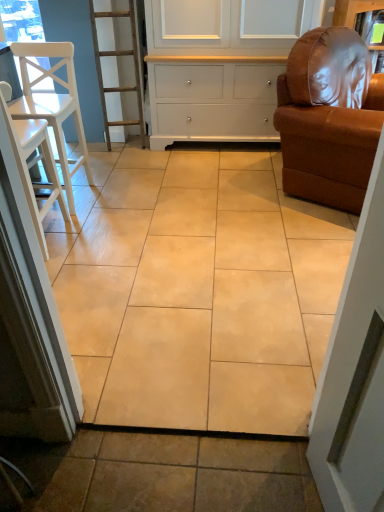
You are a GUI agent. You are given a task and a screenshot of the screen. Output one action in this format:
    pyautogui.click(x=<x>, y=<y>)
    Task: Click on the free space that is in between brown leather armchair at right, the third chair in the left-to-right sequence, and white painted wood cabinet at upper center
    The image size is (384, 512).
    Given the screenshot: What is the action you would take?
    pyautogui.click(x=236, y=164)